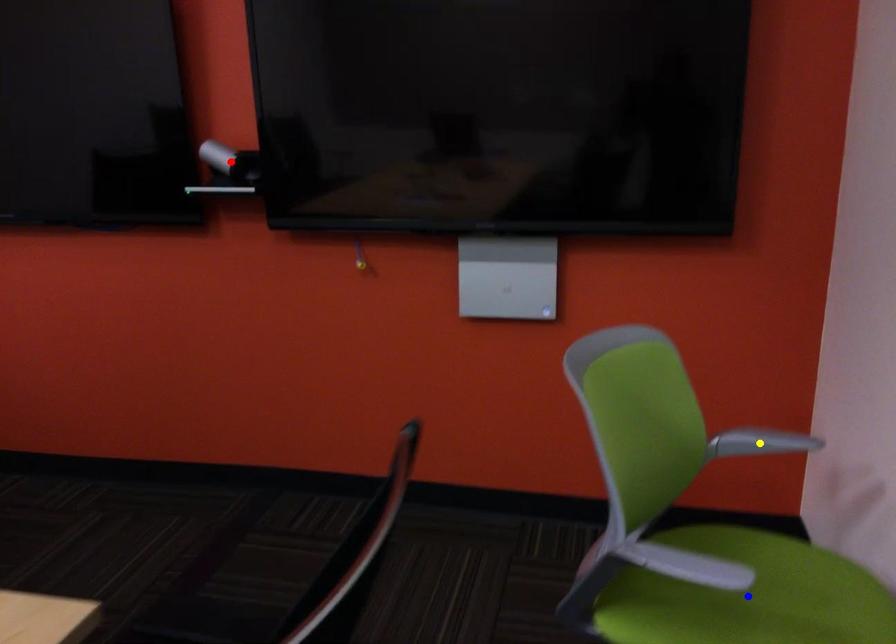
Order these from nearest to farthest:
yellow point | blue point | red point

blue point < yellow point < red point